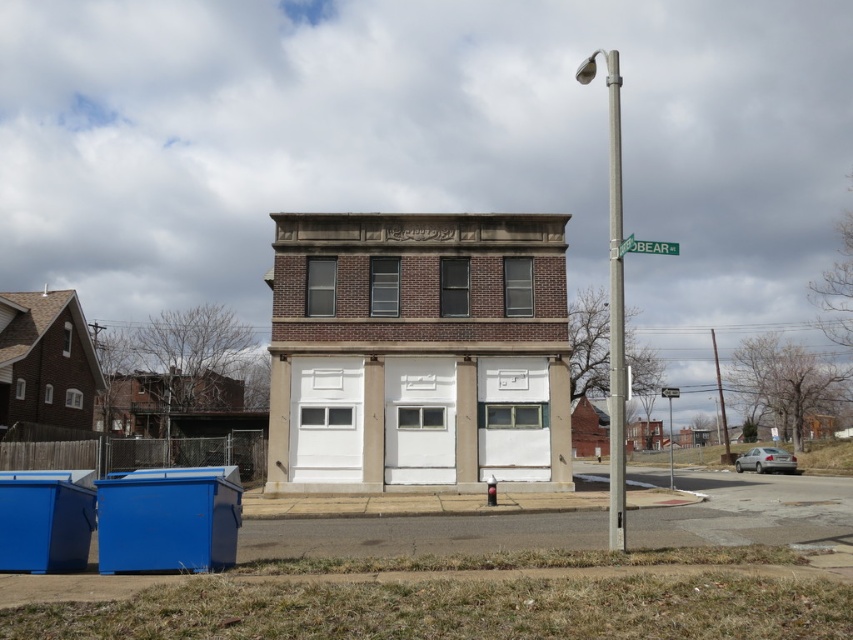
Which is behind, point (614, 339) or point (647, 241)?

The point (647, 241) is more distant.

Who is shorter, silver metallic pole at upper right or green plastic street sign at upper center?

green plastic street sign at upper center is shorter.

Who is more forward, (610, 465) or (630, 244)?

Point (630, 244) is more forward.

You are a GUI agent. You are given a task and a screenshot of the screen. Output one action in this format:
    pyautogui.click(x=<x>, y=<y>)
    Task: Click on the silver metallic pole at upper right
    
    Given the screenshot: What is the action you would take?
    [x=614, y=307]